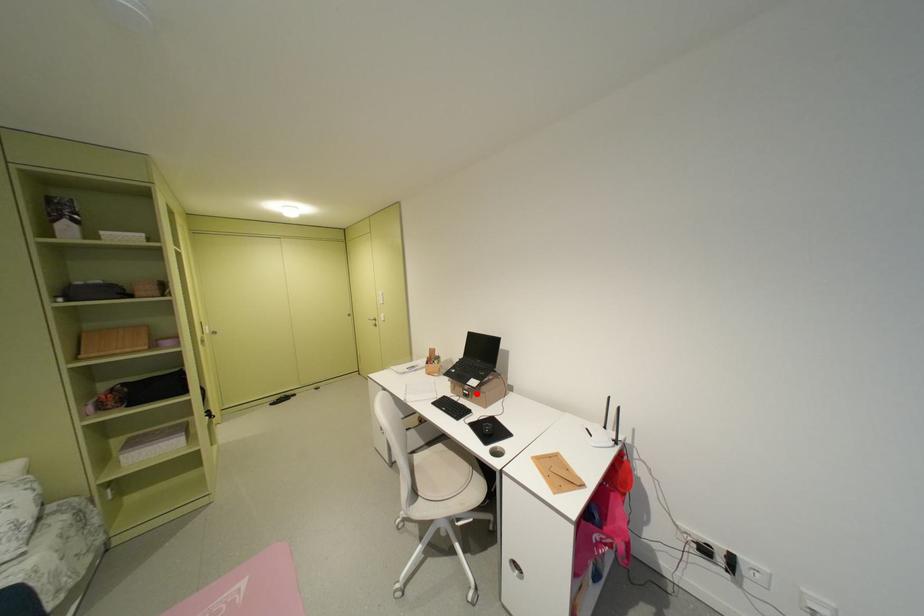
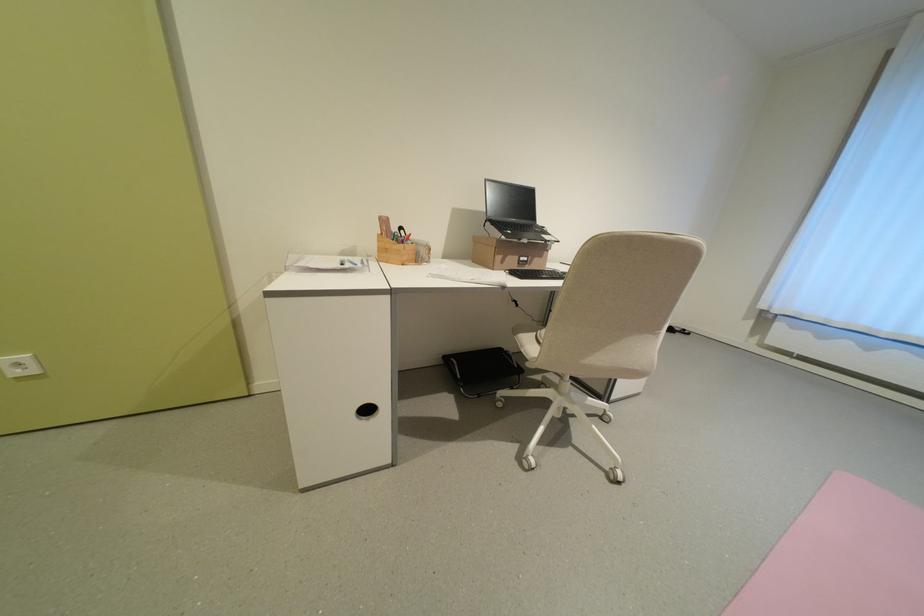
Question: I am providing you with two images of the same scene from different viewpoints. A red point is shown in image1. For the corresponding object point in image2, is it positioned nearer or farther from the camera?

Choices:
 (A) Nearer
 (B) Farther

Answer: (A)